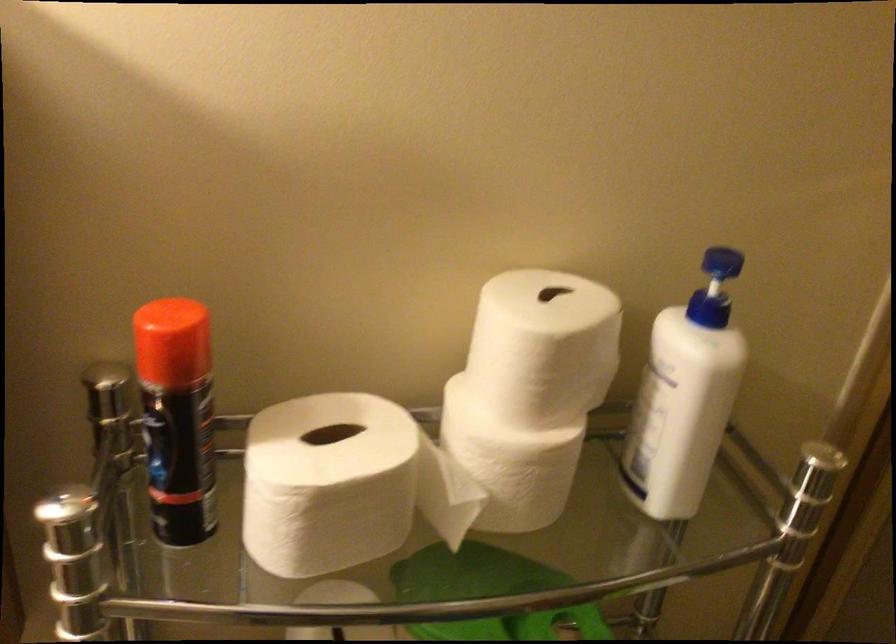
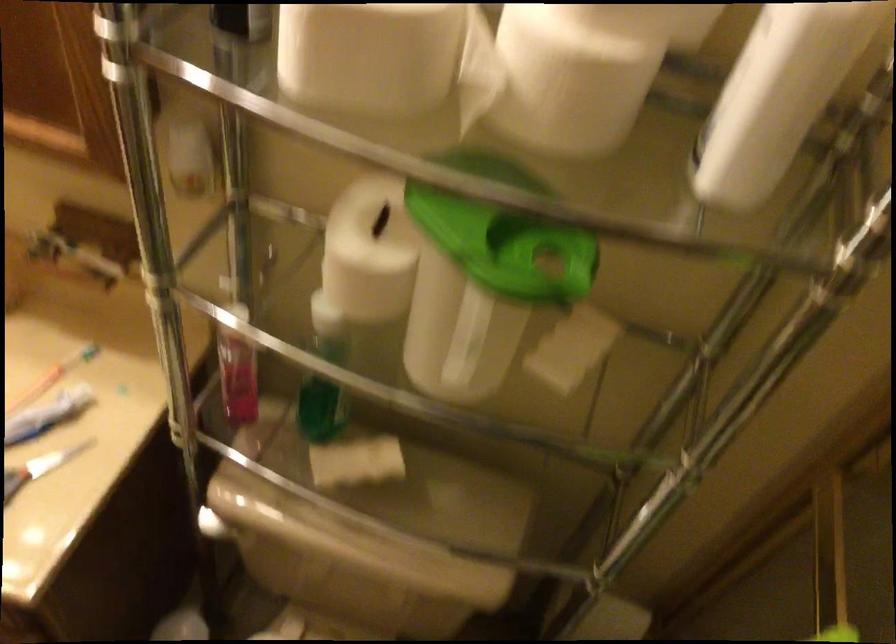
Locate, in the second image, the point that corresponds to pixel 362 518 in the first image.

(368, 55)